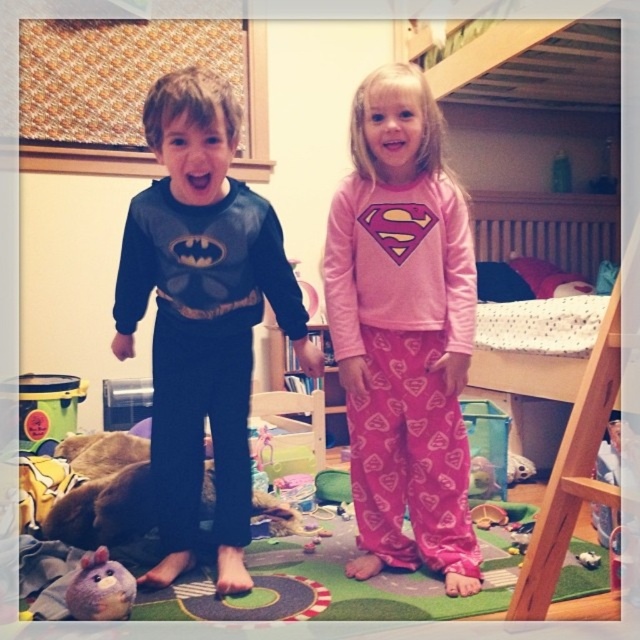
You are a parent trying to locate two specific points in your child bedroom. The first point is at coordinates point (442,563) and the second is at point (147,486). Which point is closer to the entrance of the room?

Point (442,563) is in front of point (147,486), so it is closer to the entrance of the room.

You are a parent looking for your child who is wearing a matte black sweatshirt at center. Based on the coordinates provided, where should you look in the room?

The matte black sweatshirt at center is located at point [202,314], which means it is near the center of the image. Therefore, you should look around the central area of the room to find the child wearing the matte black sweatshirt at center.

You are a parent trying to find your child a clean sweatshirt. You see the matte black sweatshirt at center and the brown fur dog at lower left. Which object is located above the other?

The matte black sweatshirt at center is positioned over the brown fur dog at lower left, so the sweatshirt is above the dog.